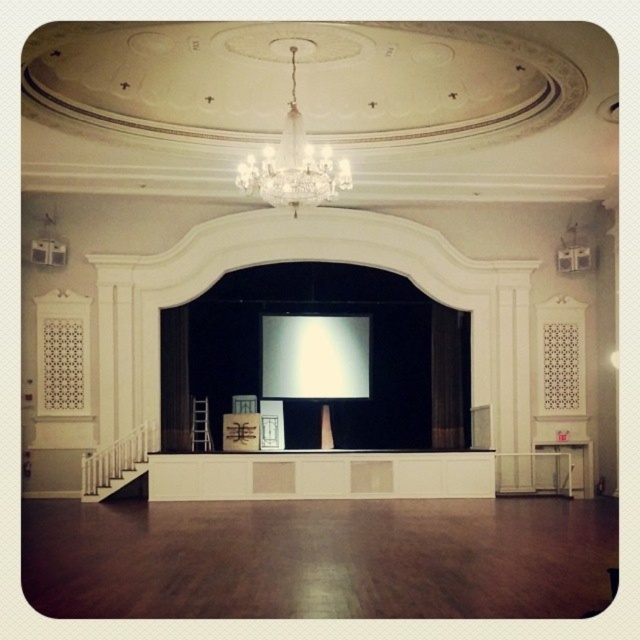
Question: Is white glossy projection screen at center smaller than crystal glass chandelier at upper center?

Choices:
 (A) no
 (B) yes

Answer: (B)

Question: Is white glossy projection screen at center further to the viewer compared to crystal glass chandelier at upper center?

Choices:
 (A) yes
 (B) no

Answer: (A)

Question: Which point appears closest to the camera in this image?

Choices:
 (A) (348, 362)
 (B) (291, 108)

Answer: (B)

Question: Considering the relative positions of white glossy projection screen at center and crystal glass chandelier at upper center in the image provided, where is white glossy projection screen at center located with respect to crystal glass chandelier at upper center?

Choices:
 (A) above
 (B) below

Answer: (B)

Question: Which point is farther to the camera?

Choices:
 (A) white glossy projection screen at center
 (B) crystal glass chandelier at upper center

Answer: (A)

Question: Which point is farther to the camera?

Choices:
 (A) white glossy projection screen at center
 (B) crystal glass chandelier at upper center

Answer: (A)